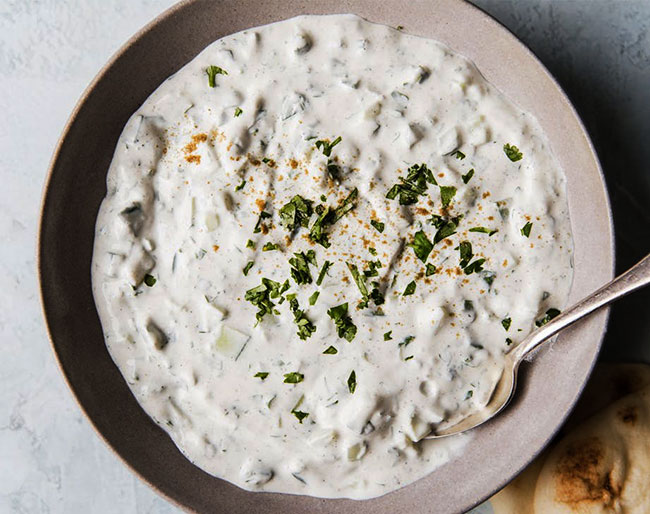
Find the location of `metal spoon handle`. metal spoon handle is located at coordinates (638, 273).